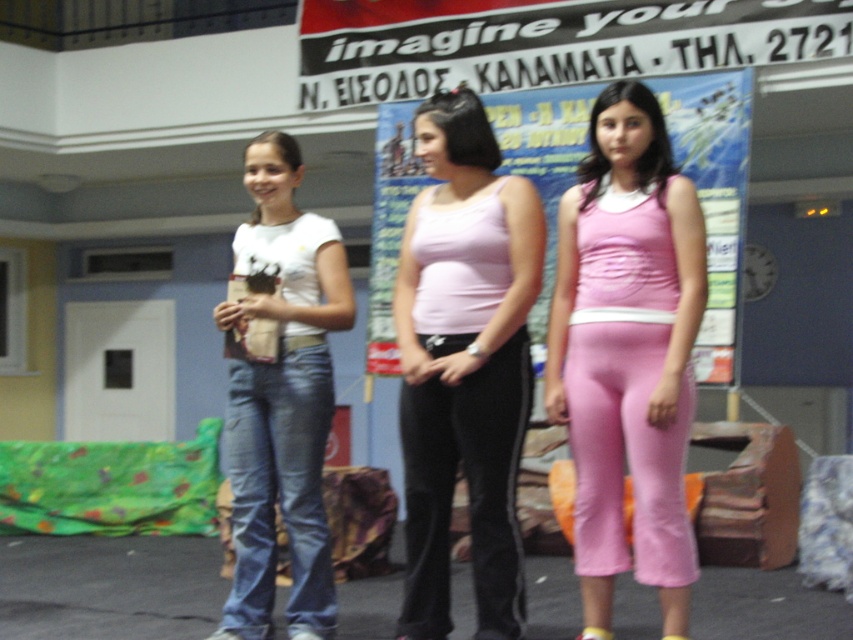
Question: Is pink fabric tank top at center above pink fabric poster at center?

Choices:
 (A) no
 (B) yes

Answer: (A)

Question: Based on their relative distances, which object is nearer to the pink fabric tank top at center?

Choices:
 (A) denim jeans at center
 (B) pink matte tank top at center

Answer: (B)

Question: Which of the following is the closest to the observer?

Choices:
 (A) (260, 157)
 (B) (283, 403)
 (C) (714, 336)

Answer: (B)

Question: Is pink fabric tank top at center closer to camera compared to pink fabric poster at center?

Choices:
 (A) yes
 (B) no

Answer: (A)

Question: Observing the image, what is the correct spatial positioning of pink fabric poster at center in reference to blue denim jeans at left?

Choices:
 (A) right
 (B) left

Answer: (A)

Question: Which point is farther from the camera taking this photo?

Choices:
 (A) (660, 412)
 (B) (265, 497)
 (C) (473, 220)

Answer: (B)